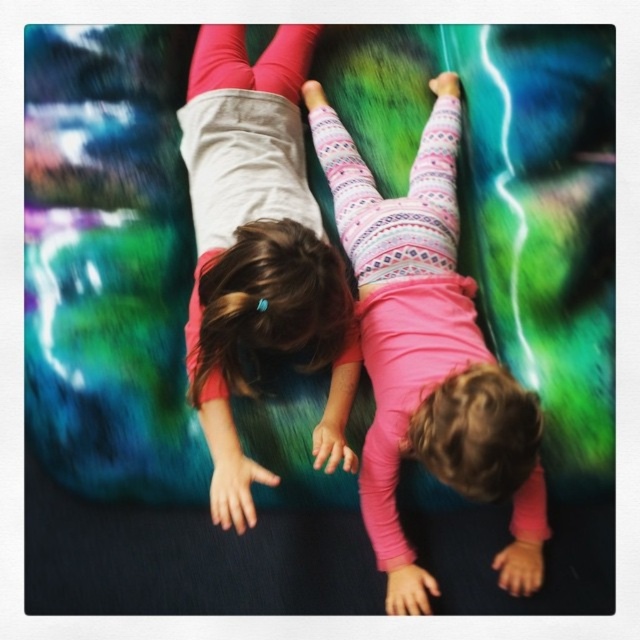
Question: Which point is closer to the camera?

Choices:
 (A) (490, 461)
 (B) (192, 321)

Answer: (A)

Question: Is pink textured leggings at center thinner than pink matte leggings at upper center?

Choices:
 (A) no
 (B) yes

Answer: (A)

Question: Does pink textured leggings at center have a smaller size compared to pink matte leggings at upper center?

Choices:
 (A) yes
 (B) no

Answer: (B)

Question: Which point is farther to the camera?

Choices:
 (A) (289, 128)
 (B) (426, 237)

Answer: (A)

Question: Can you confirm if pink textured leggings at center is bigger than pink matte leggings at upper center?

Choices:
 (A) no
 (B) yes

Answer: (B)